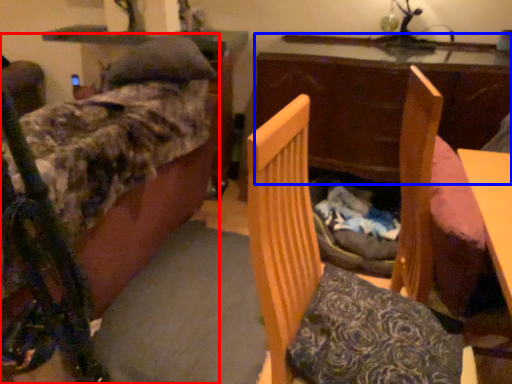
Question: Among these objects, which one is nearest to the camera, furniture (highlighted by a red box) or table (highlighted by a blue box)?

Choices:
 (A) furniture
 (B) table

Answer: (A)